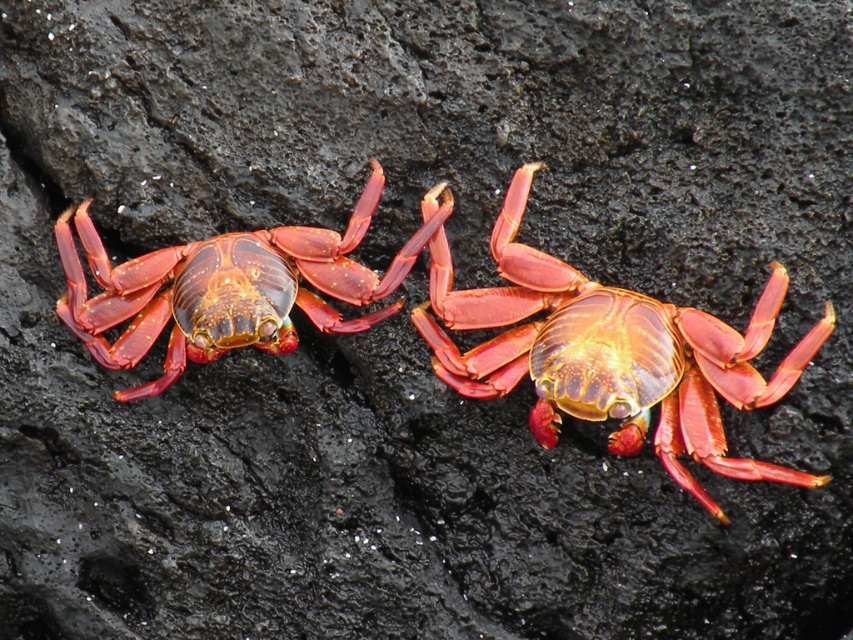
Question: Is shiny red crab at center to the right of shiny red crab at left from the viewer's perspective?

Choices:
 (A) no
 (B) yes

Answer: (B)

Question: Which point is closer to the camera?

Choices:
 (A) shiny red crab at left
 (B) shiny red crab at center

Answer: (B)

Question: Is shiny red crab at center below shiny red crab at left?

Choices:
 (A) no
 (B) yes

Answer: (B)

Question: From the image, what is the correct spatial relationship of shiny red crab at center in relation to shiny red crab at left?

Choices:
 (A) left
 (B) right

Answer: (B)